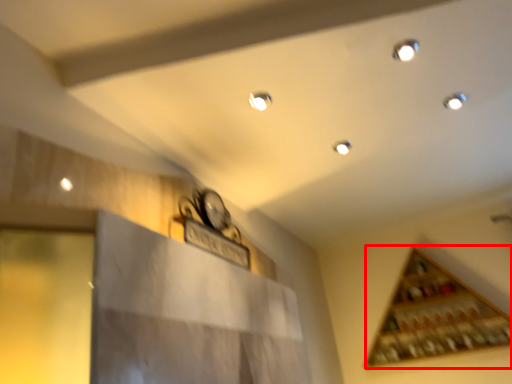
Question: Where is wine rack (annotated by the red box) located in relation to light in the image?

Choices:
 (A) left
 (B) right

Answer: (B)